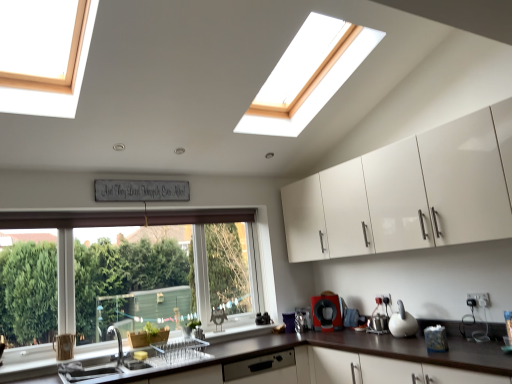
Question: Is black matte coffee maker at lower center, marked as the 2th appliance in a right-to-left arrangement, beside clear glass window at lower left?

Choices:
 (A) yes
 (B) no

Answer: (B)

Question: From a real-world perspective, is black matte coffee maker at lower center, which is counted as the second appliance, starting from the left, physically above clear glass window at lower left?

Choices:
 (A) no
 (B) yes

Answer: (A)

Question: From the image's perspective, is black matte coffee maker at lower center, placed as the second appliance when sorted from back to front, located above clear glass window at lower left?

Choices:
 (A) no
 (B) yes

Answer: (A)

Question: Is black matte coffee maker at lower center, which is counted as the second appliance, starting from the left, shorter than clear glass window at lower left?

Choices:
 (A) yes
 (B) no

Answer: (A)

Question: Is clear glass window at lower left inside black matte coffee maker at lower center, marked as the 2th appliance in a right-to-left arrangement?

Choices:
 (A) yes
 (B) no

Answer: (B)

Question: Considering the positions of satin silver dishwasher at lower center and clear glass window at lower left in the image, is satin silver dishwasher at lower center wider or thinner than clear glass window at lower left?

Choices:
 (A) thin
 (B) wide

Answer: (B)

Question: Is satin silver dishwasher at lower center bigger or smaller than clear glass window at lower left?

Choices:
 (A) big
 (B) small

Answer: (B)

Question: Is satin silver dishwasher at lower center inside or outside of clear glass window at lower left?

Choices:
 (A) inside
 (B) outside

Answer: (B)

Question: From a real-world perspective, is satin silver dishwasher at lower center above or below clear glass window at lower left?

Choices:
 (A) above
 (B) below

Answer: (B)

Question: Considering the positions of clear glass window at lower left and satin silver dishwasher at lower center in the image, is clear glass window at lower left wider or thinner than satin silver dishwasher at lower center?

Choices:
 (A) thin
 (B) wide

Answer: (A)

Question: From the image's perspective, is clear glass window at lower left positioned above or below satin silver dishwasher at lower center?

Choices:
 (A) above
 (B) below

Answer: (A)

Question: In terms of size, does clear glass window at lower left appear bigger or smaller than satin silver dishwasher at lower center?

Choices:
 (A) big
 (B) small

Answer: (A)

Question: Choose the correct answer: Is clear glass window at lower left inside satin silver dishwasher at lower center or outside it?

Choices:
 (A) inside
 (B) outside

Answer: (B)

Question: Looking at the image, does satin silver dishwasher at lower center seem bigger or smaller compared to matte stainless steel sink at lower left?

Choices:
 (A) big
 (B) small

Answer: (A)

Question: In the image, is satin silver dishwasher at lower center positioned in front of or behind matte stainless steel sink at lower left?

Choices:
 (A) front
 (B) behind

Answer: (B)